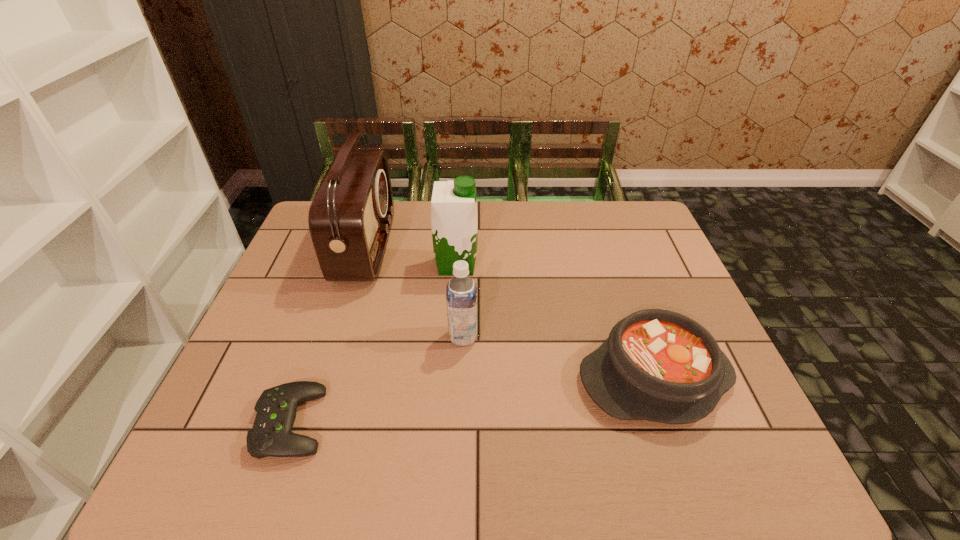
Where is `free space at the far edge`? The image size is (960, 540). free space at the far edge is located at coordinates (516, 222).

Locate an element on the screen. Image resolution: width=960 pixels, height=540 pixels. vacant space at the near edge of the desktop is located at coordinates (612, 479).

In the image, there is a desktop. What are the coordinates of `vacant space at the right edge` in the screenshot? It's located at (660, 306).

I want to click on free region at the far right corner of the desktop, so click(x=630, y=200).

Find the location of `empty location between the control and the casserole`. empty location between the control and the casserole is located at coordinates (473, 401).

At what (x,y) coordinates should I click in order to perform the action: click on free space that is in between the taller soya milk and the shortest object. Please return your answer as a coordinate pair (x, y). The image size is (960, 540). Looking at the image, I should click on (374, 344).

Where is `empty space between the shortest object and the second tallest object`? empty space between the shortest object and the second tallest object is located at coordinates (374, 344).

In order to click on vacant area between the control and the taller soya milk in this screenshot , I will do `click(374, 344)`.

In order to click on vacant point located between the nearer soya milk and the radio receiver in this screenshot , I will do `click(415, 292)`.

The image size is (960, 540). What are the coordinates of `free space between the second shortest object and the control` in the screenshot? It's located at (473, 401).